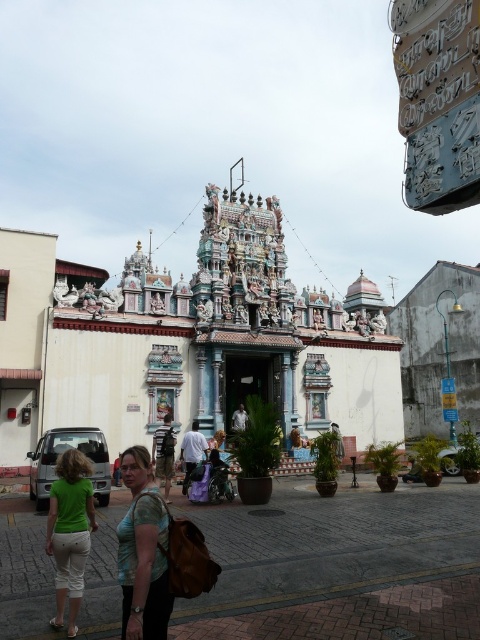
Question: Which object appears closest to the camera in this image?

Choices:
 (A) white painted temple at center
 (B) green fabric shirt at center
 (C) green matte shorts at lower left
 (D) light brown fabric shirt at center

Answer: (B)

Question: Does green fabric shirt at center have a greater width compared to white fabric pants at center?

Choices:
 (A) yes
 (B) no

Answer: (A)

Question: Can you confirm if green matte shorts at lower left is bigger than white fabric pants at center?

Choices:
 (A) yes
 (B) no

Answer: (A)

Question: Is white painted temple at center to the left of green matte shorts at lower left from the viewer's perspective?

Choices:
 (A) no
 (B) yes

Answer: (A)

Question: Among these objects, which one is farthest from the camera?

Choices:
 (A) white painted temple at center
 (B) white fabric pants at center
 (C) green fabric shirt at center
 (D) green matte shorts at lower left

Answer: (A)

Question: Estimate the real-world distances between objects in this image. Which object is farther from the white painted temple at center?

Choices:
 (A) green fabric shirt at center
 (B) white fabric pants at center
 (C) green matte shorts at lower left

Answer: (C)